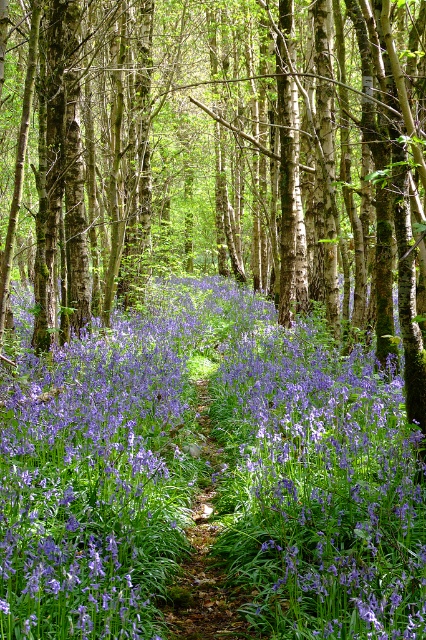
You are a botanist studying the forest floor. You observe the purple flowerbed at center and the purple matte flower at center. Which of these two has a greater width?

The purple flowerbed at center is wider than the purple matte flower at center.

You are a hiker who wants to pick the purple matte flower at center. Can you reach it without stepping on the green leafy trail at center?

The purple matte flower at center is above the green leafy trail at center, so yes, you can reach it without stepping on the trail.

You are a botanist examining the purple flowerbed at center and the purple matte flower at center in the forest. Which one has a bigger size?

The purple flowerbed at center has a larger size compared to the purple matte flower at center.